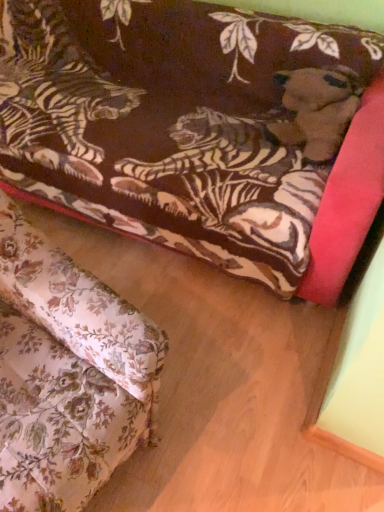
Question: Considering the positions of velvet tiger-patterned couch at upper center, which ranks as the first studio couch in back-to-front order, and velvet tiger-patterned couch at upper center, arranged as the 2th studio couch when viewed from the back, in the image, is velvet tiger-patterned couch at upper center, which ranks as the first studio couch in back-to-front order, taller or shorter than velvet tiger-patterned couch at upper center, arranged as the 2th studio couch when viewed from the back,?

Choices:
 (A) short
 (B) tall

Answer: (A)

Question: Is point (243, 92) closer or farther from the camera than point (59, 287)?

Choices:
 (A) closer
 (B) farther

Answer: (B)

Question: From a real-world perspective, is velvet tiger-patterned couch at upper center, which ranks as the first studio couch in back-to-front order, physically located above or below velvet tiger-patterned couch at upper center, which ranks as the first studio couch in front-to-back order?

Choices:
 (A) below
 (B) above

Answer: (A)

Question: In terms of size, does velvet tiger-patterned couch at upper center, which ranks as the first studio couch in front-to-back order, appear bigger or smaller than velvet tiger-patterned couch at upper center, which ranks as the first studio couch in back-to-front order?

Choices:
 (A) small
 (B) big

Answer: (A)

Question: From a real-world perspective, relative to velvet tiger-patterned couch at upper center, which is the second studio couch in front-to-back order, is velvet tiger-patterned couch at upper center, arranged as the 2th studio couch when viewed from the back, vertically above or below?

Choices:
 (A) above
 (B) below

Answer: (A)

Question: Is velvet tiger-patterned couch at upper center, which ranks as the first studio couch in front-to-back order, situated inside velvet tiger-patterned couch at upper center, which ranks as the first studio couch in back-to-front order, or outside?

Choices:
 (A) outside
 (B) inside

Answer: (A)

Question: From the image's perspective, relative to velvet tiger-patterned couch at upper center, which ranks as the first studio couch in back-to-front order, is velvet tiger-patterned couch at upper center, arranged as the 2th studio couch when viewed from the back, above or below?

Choices:
 (A) below
 (B) above

Answer: (A)